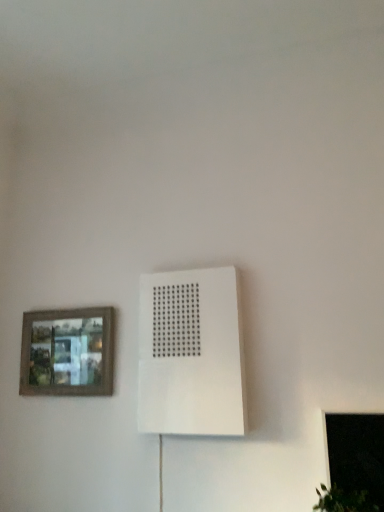
Question: Is white matte air conditioning at center smaller than transparent glass window at lower right?

Choices:
 (A) yes
 (B) no

Answer: (B)

Question: Is white matte air conditioning at center directly adjacent to transparent glass window at lower right?

Choices:
 (A) yes
 (B) no

Answer: (B)

Question: Is transparent glass window at lower right at the back of white matte air conditioning at center?

Choices:
 (A) yes
 (B) no

Answer: (B)

Question: Considering the relative sizes of white matte air conditioning at center and transparent glass window at lower right in the image provided, is white matte air conditioning at center wider than transparent glass window at lower right?

Choices:
 (A) yes
 (B) no

Answer: (A)

Question: Is white matte air conditioning at center bigger than transparent glass window at lower right?

Choices:
 (A) yes
 (B) no

Answer: (A)

Question: Is white matte air conditioning at center to the left of transparent glass window at lower right from the viewer's perspective?

Choices:
 (A) yes
 (B) no

Answer: (A)

Question: From a real-world perspective, is transparent glass window at lower right physically above wooden framed picture at left?

Choices:
 (A) no
 (B) yes

Answer: (A)

Question: Considering the relative positions of transparent glass window at lower right and wooden framed picture at left in the image provided, is transparent glass window at lower right to the left of wooden framed picture at left from the viewer's perspective?

Choices:
 (A) yes
 (B) no

Answer: (B)

Question: Is transparent glass window at lower right far from wooden framed picture at left?

Choices:
 (A) no
 (B) yes

Answer: (B)

Question: Is wooden framed picture at left inside transparent glass window at lower right?

Choices:
 (A) no
 (B) yes

Answer: (A)

Question: Is transparent glass window at lower right aimed at wooden framed picture at left?

Choices:
 (A) yes
 (B) no

Answer: (B)

Question: From the image's perspective, is transparent glass window at lower right on wooden framed picture at left?

Choices:
 (A) yes
 (B) no

Answer: (B)

Question: Can white matte air conditioning at center be found inside transparent glass window at lower right?

Choices:
 (A) no
 (B) yes

Answer: (A)